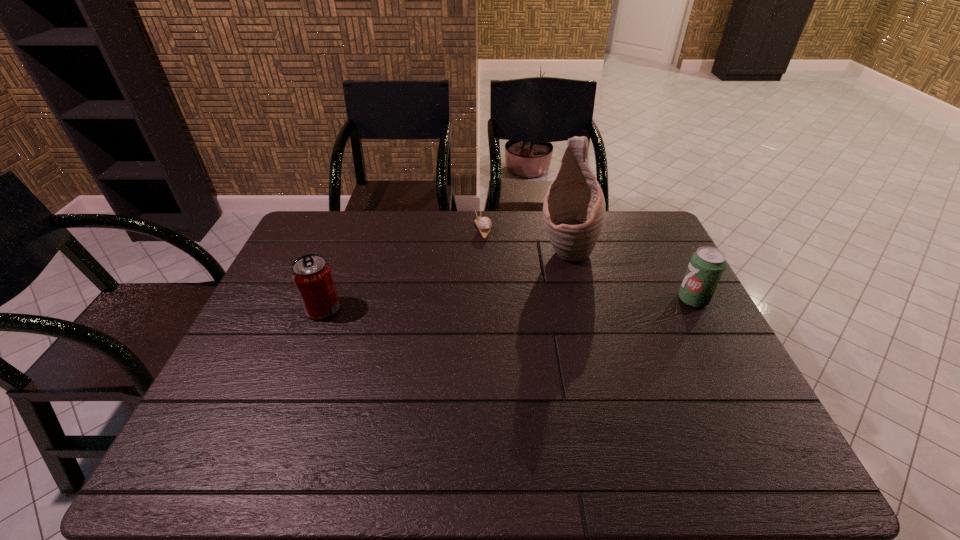
You are a GUI agent. You are given a task and a screenshot of the screen. Output one action in this format:
    pyautogui.click(x=<x>, y=<y>)
    Task: Click on the vacant space located at the spout of the pitcher
    This screenshot has height=540, width=960.
    Given the screenshot: What is the action you would take?
    pyautogui.click(x=559, y=319)

Locate an element on the screen. The height and width of the screenshot is (540, 960). vacant space situated on the shell of the shortest object is located at coordinates (496, 258).

Identify the location of vacant space located on the shell of the shortest object. This screenshot has width=960, height=540. (515, 292).

Identify the location of vacant space located 0.050m on the shell of the shortest object. This screenshot has height=540, width=960. (491, 247).

Where is `pitcher present at the far edge`? This screenshot has width=960, height=540. pitcher present at the far edge is located at coordinates (574, 210).

This screenshot has width=960, height=540. I want to click on escargot that is at the far edge, so click(484, 224).

At what (x,y) coordinates should I click in order to perform the action: click on object located in the left edge section of the desktop. Please return your answer as a coordinate pair (x, y). This screenshot has height=540, width=960. Looking at the image, I should click on (312, 275).

Find the location of a particular element. Image resolution: width=960 pixels, height=540 pixels. object that is at the right edge is located at coordinates click(706, 266).

You are a GUI agent. You are given a task and a screenshot of the screen. Output one action in this format:
    pyautogui.click(x=<x>, y=<y>)
    Task: Click on the vacant region at the far edge of the desktop
    Image resolution: width=960 pixels, height=540 pixels.
    Given the screenshot: What is the action you would take?
    pyautogui.click(x=534, y=244)

Identify the location of free point at the near edge. (443, 417).